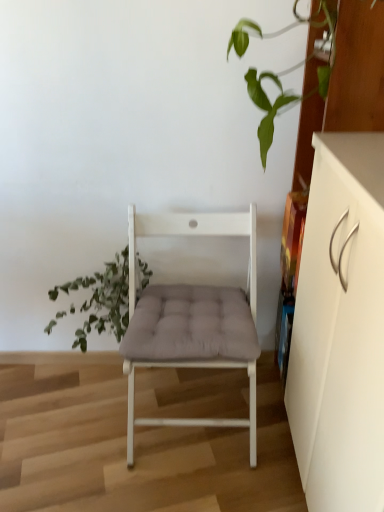
Measure the distance between white matte cabinet at right and camera.

A distance of 26.99 inches exists between white matte cabinet at right and camera.

Locate an element on the screen. white matte chair at center is located at coordinates (192, 318).

Find the location of `green leafy plant at left`. green leafy plant at left is located at coordinates (102, 298).

Is point (96, 276) closer to viewer compared to point (231, 358)?

No, it is not.

Is green leafy plant at left wider or thinner than white matte chair at center?

In the image, green leafy plant at left appears to be more narrow than white matte chair at center.

Is green leafy plant at left oriented towards white matte chair at center?

No.

Is white matte cabinet at right facing away from white matte chair at center?

No, white matte chair at center is not at the back of white matte cabinet at right.

Is white matte cabinet at right thinner than white matte chair at center?

Correct, the width of white matte cabinet at right is less than that of white matte chair at center.

Can you confirm if white matte cabinet at right is bigger than white matte chair at center?

Yes.

From the image's perspective, does white matte chair at center appear higher than white matte cabinet at right?

Yes.

Is white matte chair at center not inside white matte cabinet at right?

Indeed, white matte chair at center is completely outside white matte cabinet at right.

From a real-world perspective, which object stands above the other?

white matte cabinet at right is physically above.

Based on the photo, measure the distance between white matte chair at center and white matte cabinet at right.

white matte chair at center and white matte cabinet at right are 16.91 inches apart.

Locate an element on the screen. houseplant that is under the white matte cabinet at right (from a real-world perspective) is located at coordinates (102, 298).

Does point (374, 300) come farther from viewer compared to point (60, 313)?

No, (374, 300) is in front of (60, 313).

Looking at this image, how different are the orientations of white matte cabinet at right and green leafy plant at left in degrees?

89.8 degrees separate the facing orientations of white matte cabinet at right and green leafy plant at left.

From their relative heights in the image, would you say white matte cabinet at right is taller or shorter than green leafy plant at left?

Clearly, white matte cabinet at right is taller compared to green leafy plant at left.

Does green leafy plant at left have a larger size compared to white matte cabinet at right?

No.

Find the location of a particular element. This screenshot has width=384, height=512. cabinetry that appears on the right of green leafy plant at left is located at coordinates (340, 328).

Is green leafy plant at left not inside white matte cabinet at right?

Yes, green leafy plant at left is outside of white matte cabinet at right.

Does white matte chair at center have a greater height compared to green leafy plant at left?

Yes.

Considering the positions of point (220, 359) and point (85, 330), is point (220, 359) closer or farther from the camera than point (85, 330)?

Point (220, 359) is positioned closer to the camera compared to point (85, 330).

Is green leafy plant at left completely or partially inside white matte chair at center?

That's incorrect, green leafy plant at left is not inside white matte chair at center.

Is white matte chair at center placed right next to green leafy plant at left?

No.

In the image, there is a white matte chair at center. At what (x,y) coordinates should I click in order to perform the action: click on houseplant below it (from a real-world perspective). Please return your answer as a coordinate pair (x, y). Image resolution: width=384 pixels, height=512 pixels. Looking at the image, I should click on (x=102, y=298).

Locate an element on the screen. This screenshot has height=512, width=384. cabinetry located below the white matte chair at center (from the image's perspective) is located at coordinates [340, 328].

Estimate the real-world distances between objects in this image. Which object is closer to white matte cabinet at right, white matte chair at center or green leafy plant at left?

white matte chair at center lies closer to white matte cabinet at right than the other object.

Considering their positions, is green leafy plant at left positioned closer to white matte cabinet at right than white matte chair at center?

The object closer to white matte cabinet at right is white matte chair at center.

Considering their positions, is green leafy plant at left positioned closer to white matte chair at center than white matte cabinet at right?

green leafy plant at left is closer to white matte chair at center.

Based on their spatial positions, is white matte cabinet at right or white matte chair at center closer to green leafy plant at left?

white matte chair at center is positioned closer to the anchor green leafy plant at left.

Consider the image. When comparing their distances from green leafy plant at left, does white matte chair at center or white matte cabinet at right seem further?

white matte cabinet at right.

Looking at this image, considering their positions, is white matte cabinet at right positioned further to white matte chair at center than green leafy plant at left?

Among the two, white matte cabinet at right is located further to white matte chair at center.

The width and height of the screenshot is (384, 512). I want to click on chair between white matte cabinet at right and green leafy plant at left in the front-back direction, so click(x=192, y=318).